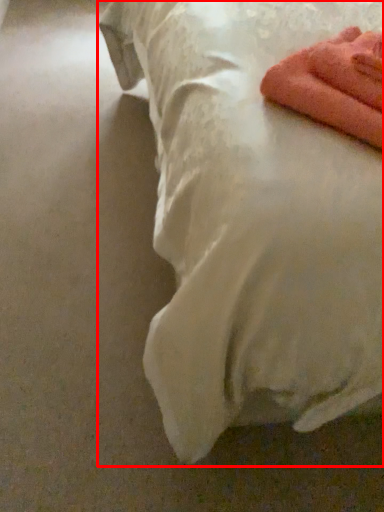
Question: From the image's perspective, where is bed (annotated by the red box) located relative to towel?

Choices:
 (A) above
 (B) below

Answer: (A)